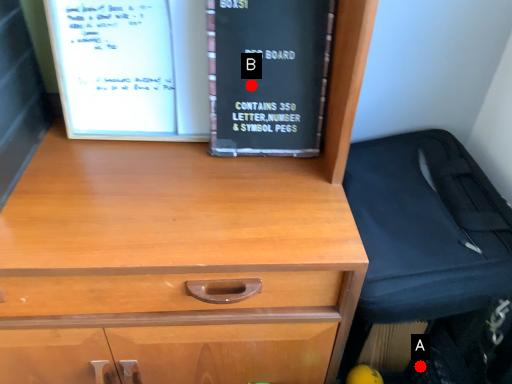
Question: Two points are circled on the image, labeled by A and B beside each circle. Which point is farther from the camera taking this photo?

Choices:
 (A) A is further
 (B) B is further

Answer: (A)